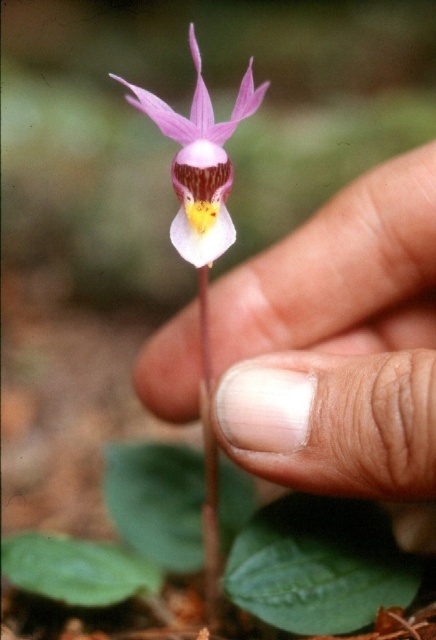
Question: Which of the following is the farthest from the observer?

Choices:
 (A) (310, 412)
 (B) (204, 545)
 (C) (187, 129)

Answer: (B)

Question: Does smooth skin hand at center appear under purple matte orchid at center?

Choices:
 (A) yes
 (B) no

Answer: (A)

Question: Which point appears closest to the camera in this image?

Choices:
 (A) (207, 236)
 (B) (245, 465)
 (C) (207, 580)

Answer: (B)

Question: Observing the image, what is the correct spatial positioning of smooth skin hand at center in reference to purple matte orchid at center?

Choices:
 (A) left
 (B) right

Answer: (B)

Question: Which object is farther from the camera taking this photo?

Choices:
 (A) smooth skin hand at center
 (B) green matte stem at center

Answer: (B)

Question: Does smooth skin hand at center have a larger size compared to purple matte orchid at center?

Choices:
 (A) yes
 (B) no

Answer: (A)